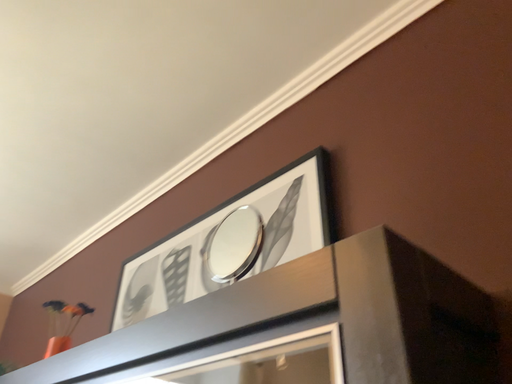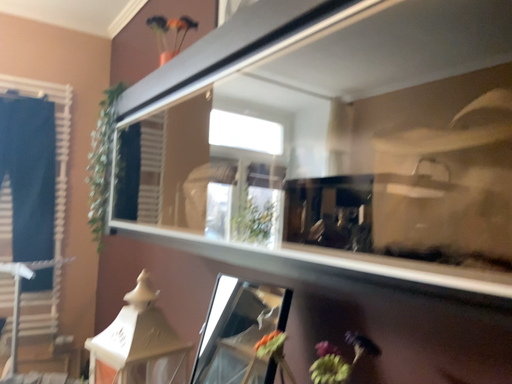
Question: How did the camera likely rotate when shooting the video?

Choices:
 (A) rotated downward
 (B) rotated upward

Answer: (A)